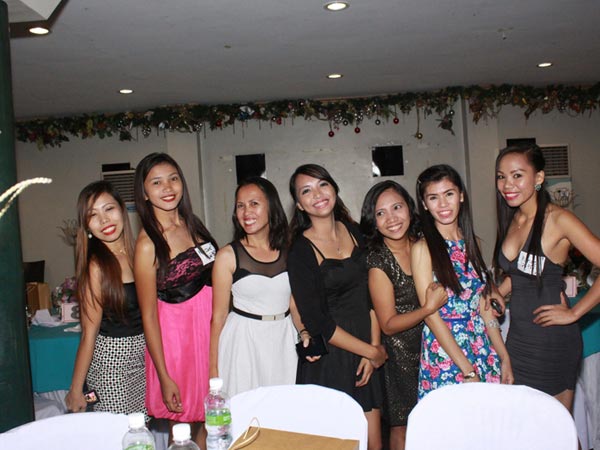
You are a GUI agent. You are given a task and a screenshot of the screen. Output one action in this format:
    pyautogui.click(x=<x>, y=<y>)
    Task: Click on the turquoise tablecloth
    Image resolution: width=600 pixels, height=450 pixels.
    Given the screenshot: What is the action you would take?
    pyautogui.click(x=50, y=356), pyautogui.click(x=593, y=335)